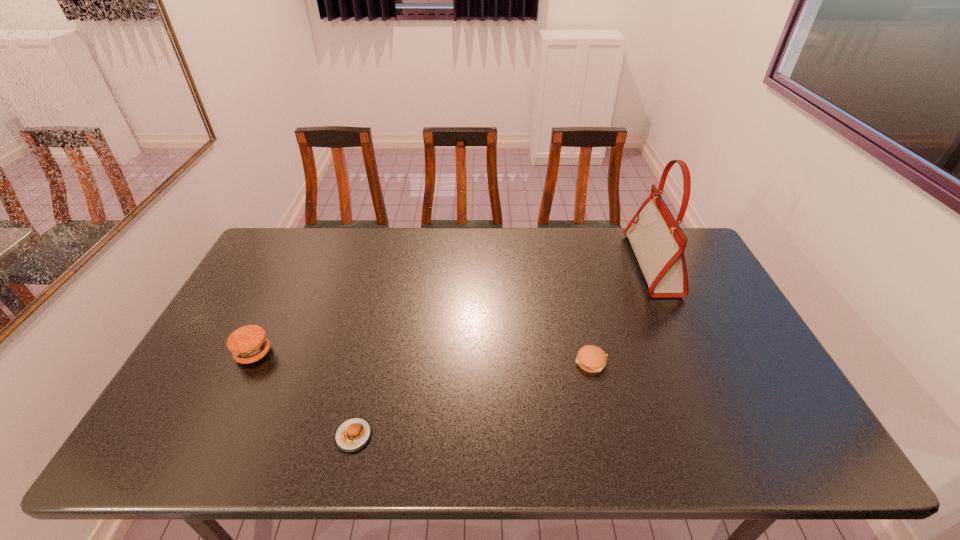
At what (x,y) coordinates should I click in order to perform the action: click on handbag. Please return your answer as a coordinate pair (x, y). The height and width of the screenshot is (540, 960). Looking at the image, I should click on (658, 242).

Locate an element on the screen. the rightmost object is located at coordinates (658, 242).

What are the coordinates of `the leftmost food` in the screenshot? It's located at (248, 344).

Locate an element on the screen. the leftmost object is located at coordinates (248, 344).

Locate an element on the screen. This screenshot has height=540, width=960. the third object from left to right is located at coordinates (590, 358).

Where is `the rightmost food`? The image size is (960, 540). the rightmost food is located at coordinates (590, 358).

At what (x,y) coordinates should I click in order to perform the action: click on the shortest food. Please return your answer as a coordinate pair (x, y). Looking at the image, I should click on (353, 434).

Find the location of a particular element. The image size is (960, 540). the nearest food is located at coordinates (353, 434).

Find the location of a particular element. This screenshot has height=540, width=960. vacant point located on the front of the farthest object is located at coordinates (699, 367).

What are the coordinates of `vacant area situated on the right of the second tallest object` in the screenshot? It's located at (392, 353).